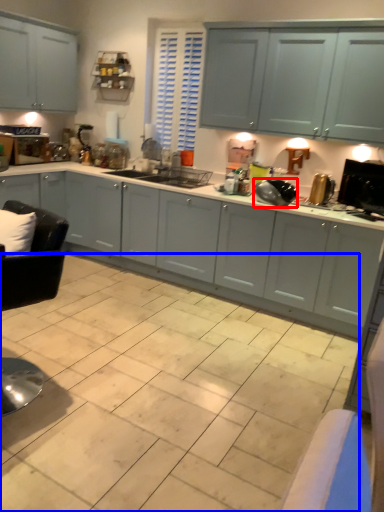
Question: Among these objects, which one is farthest to the camera, appliance (highlighted by a red box) or ceramic tile (highlighted by a blue box)?

Choices:
 (A) appliance
 (B) ceramic tile

Answer: (A)